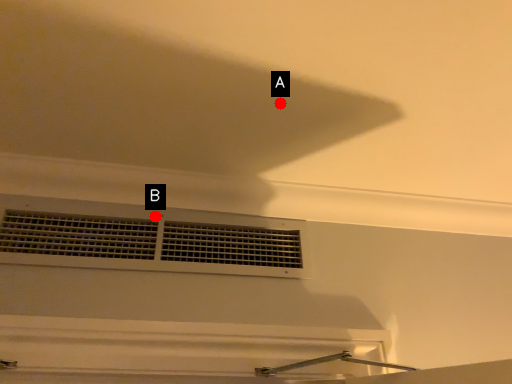
Question: Two points are circled on the image, labeled by A and B beside each circle. Which point is farther to the camera?

Choices:
 (A) A is further
 (B) B is further

Answer: (B)